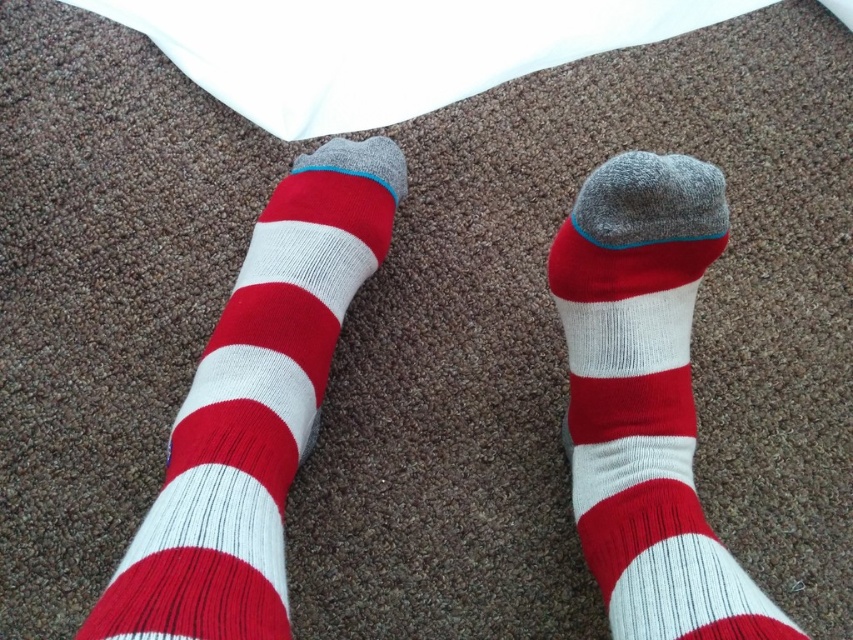
Is red/white striped sock at center above matte white/red striped sock at center?

Indeed, red/white striped sock at center is positioned over matte white/red striped sock at center.

Who is shorter, red/white striped sock at center or matte white/red striped sock at center?

matte white/red striped sock at center is shorter.

Is point (274, 550) farther from camera compared to point (621, 579)?

No, it is not.

Identify the location of red/white striped sock at center. The height and width of the screenshot is (640, 853). (254, 410).